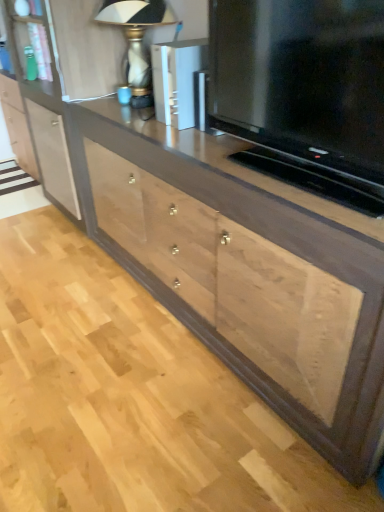
Question: Is natural wood drawer at center wider or thinner than metallic silver speaker at upper center?

Choices:
 (A) thin
 (B) wide

Answer: (B)

Question: In the image, is natural wood drawer at center positioned in front of or behind metallic silver speaker at upper center?

Choices:
 (A) behind
 (B) front

Answer: (B)

Question: Estimate the real-world distances between objects in this image. Which object is closer to the metallic silver speaker at upper center?

Choices:
 (A) matte black television at center
 (B) matte glass table lamp at upper center
 (C) natural wood drawer at center

Answer: (B)

Question: Based on their relative distances, which object is farther from the metallic silver speaker at upper center?

Choices:
 (A) matte glass table lamp at upper center
 (B) natural wood drawer at center
 (C) matte black television at center

Answer: (B)